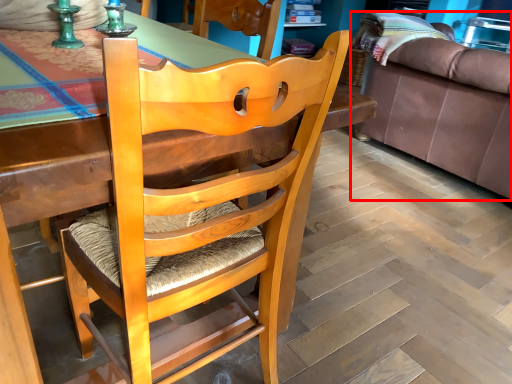
Question: Observing the image, what is the correct spatial positioning of studio couch (annotated by the red box) in reference to chair?

Choices:
 (A) right
 (B) left

Answer: (A)